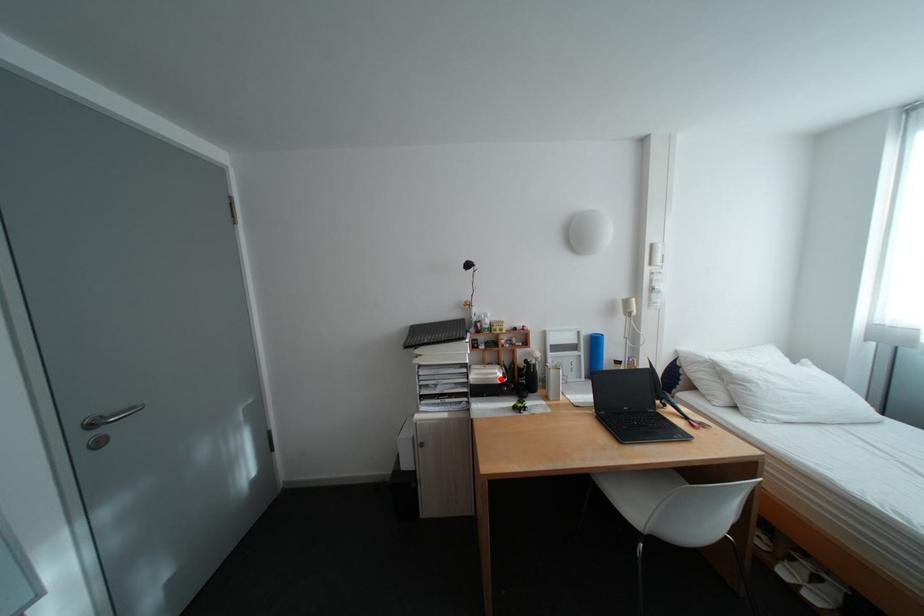
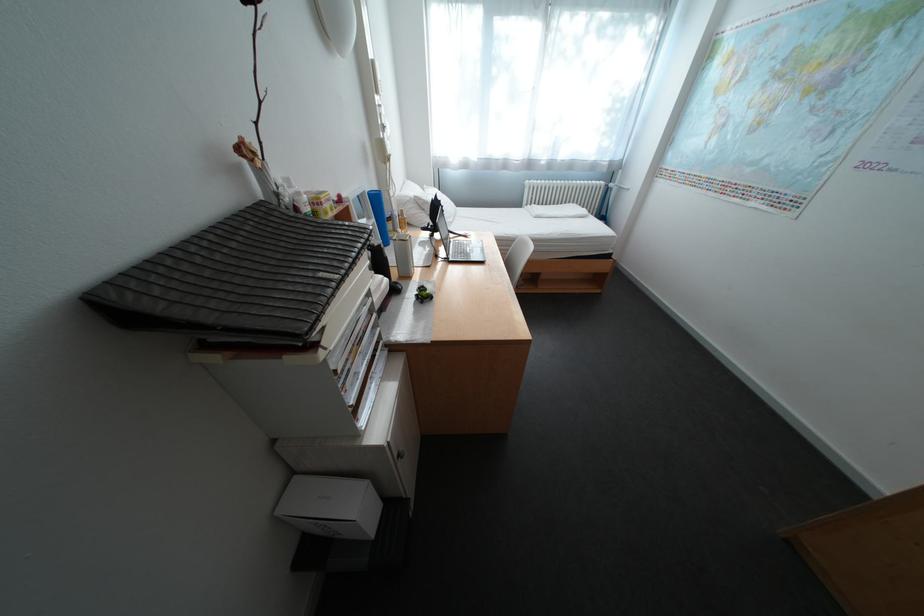
Question: I am providing you with two images of the same scene from different viewpoints. A red point is shown in image1. For the corresponding object point in image2, is it positioned nearer or farther from the camera?

Choices:
 (A) Nearer
 (B) Farther

Answer: (A)